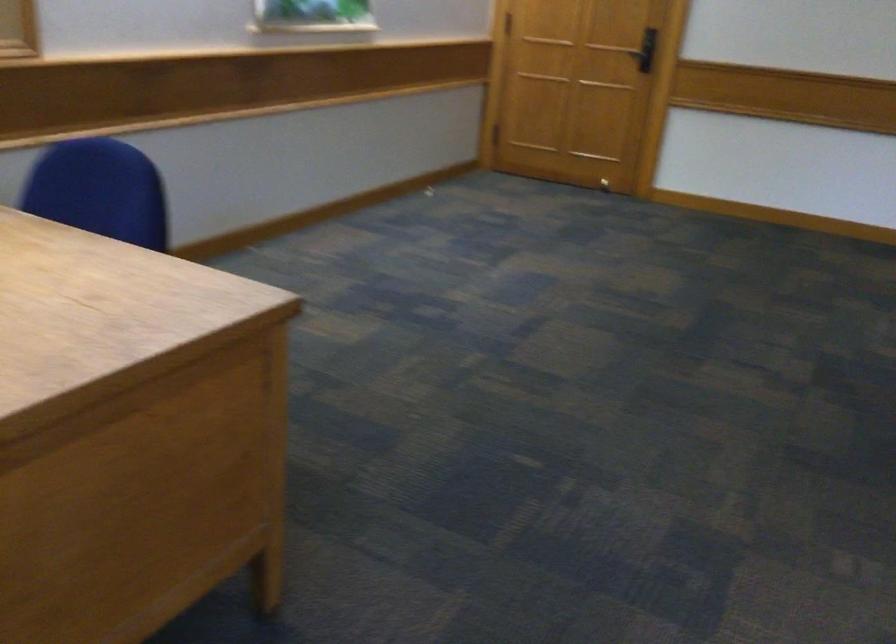
Question: The first image is from the beginning of the video and the second image is from the end. How did the camera likely rotate when shooting the video?

Choices:
 (A) Left
 (B) Right
 (C) Up
 (D) Down

Answer: (B)